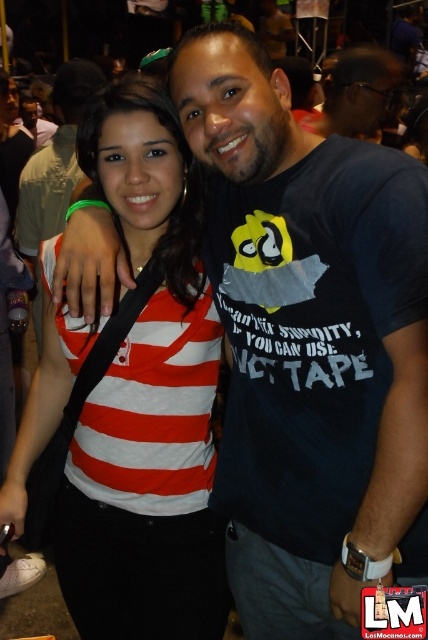
Question: Which object appears closest to the camera in this image?

Choices:
 (A) matte black t-shirt at upper center
 (B) striped cotton shirt at center

Answer: (B)

Question: From the image, what is the correct spatial relationship of striped cotton shirt at center in relation to matte black t-shirt at upper center?

Choices:
 (A) below
 (B) above

Answer: (A)

Question: Which of the following is the farthest from the observer?

Choices:
 (A) matte black t-shirt at upper center
 (B) striped cotton shirt at center

Answer: (A)

Question: Can you confirm if striped cotton shirt at center is bigger than matte black t-shirt at upper center?

Choices:
 (A) no
 (B) yes

Answer: (A)

Question: Is striped cotton shirt at center to the right of matte black t-shirt at upper center from the viewer's perspective?

Choices:
 (A) no
 (B) yes

Answer: (A)